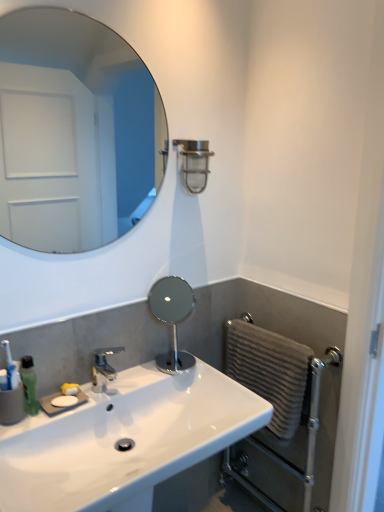
At what (x,y) coordinates should I click in order to perform the action: click on free space below polished silver mirror at center, acting as the 2th mirror starting from the top (from a real-world perspective). Please return your answer as a coordinate pair (x, y). Looking at the image, I should click on (186, 359).